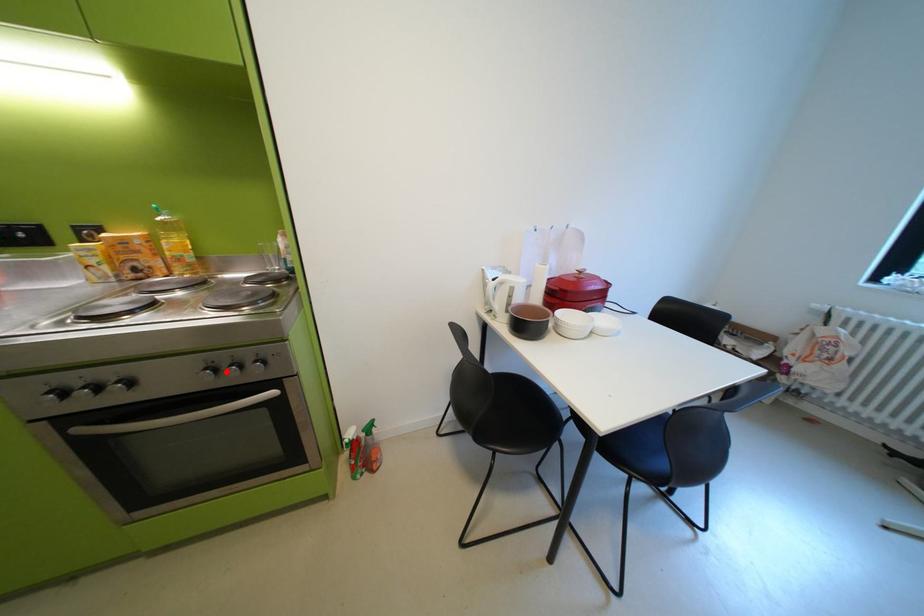
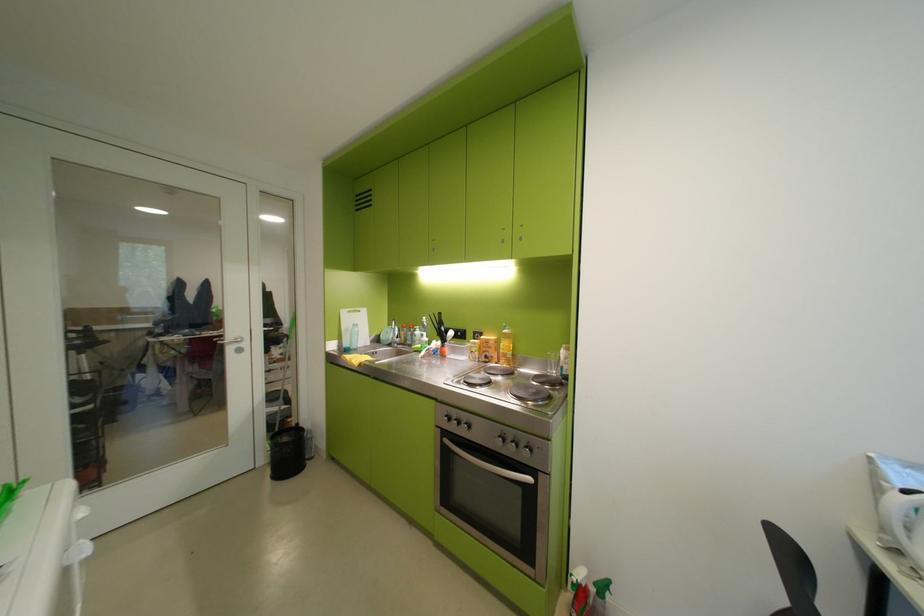
Locate, in the second image, the point that corresponds to the highlighted location in the first image.

(515, 440)